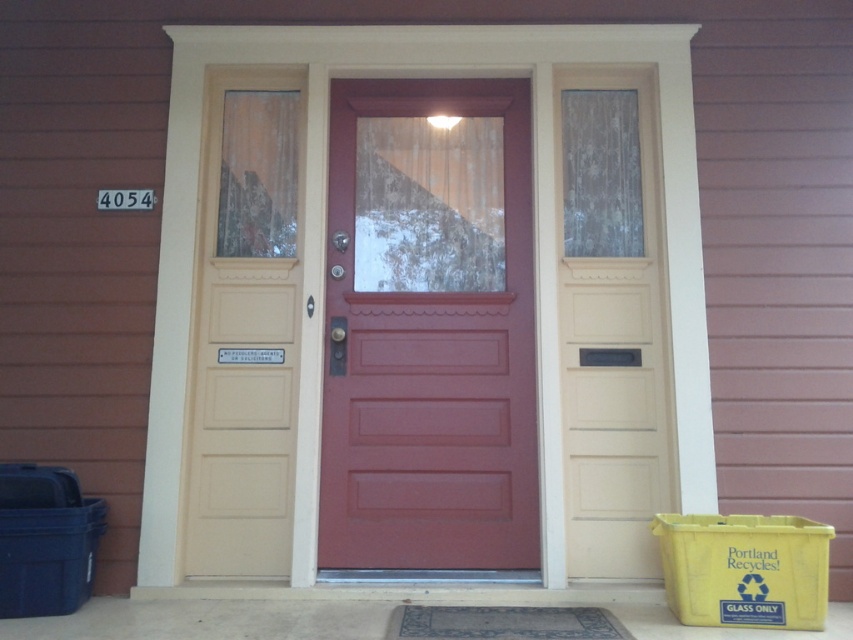
Who is more distant from viewer, (248, 317) or (585, 636)?

The point (248, 317) is more distant.

You are a GUI agent. You are given a task and a screenshot of the screen. Output one action in this format:
    pyautogui.click(x=<x>, y=<y>)
    Task: Click on the matte cream door at center
    Image resolution: width=853 pixels, height=640 pixels.
    Given the screenshot: What is the action you would take?
    pyautogui.click(x=245, y=328)

Who is more forward, (274, 168) or (456, 621)?

Point (456, 621)

The height and width of the screenshot is (640, 853). I want to click on matte cream door at center, so click(245, 328).

Does matte red door at center have a lesser height compared to matte cream door at center?

Yes.

What do you see at coordinates (428, 328) in the screenshot? The width and height of the screenshot is (853, 640). I see `matte red door at center` at bounding box center [428, 328].

The image size is (853, 640). What are the coordinates of `matte red door at center` in the screenshot? It's located at (428, 328).

Locate an element on the screen. matte red door at center is located at coordinates (428, 328).

The height and width of the screenshot is (640, 853). I want to click on matte red door at center, so click(x=428, y=328).